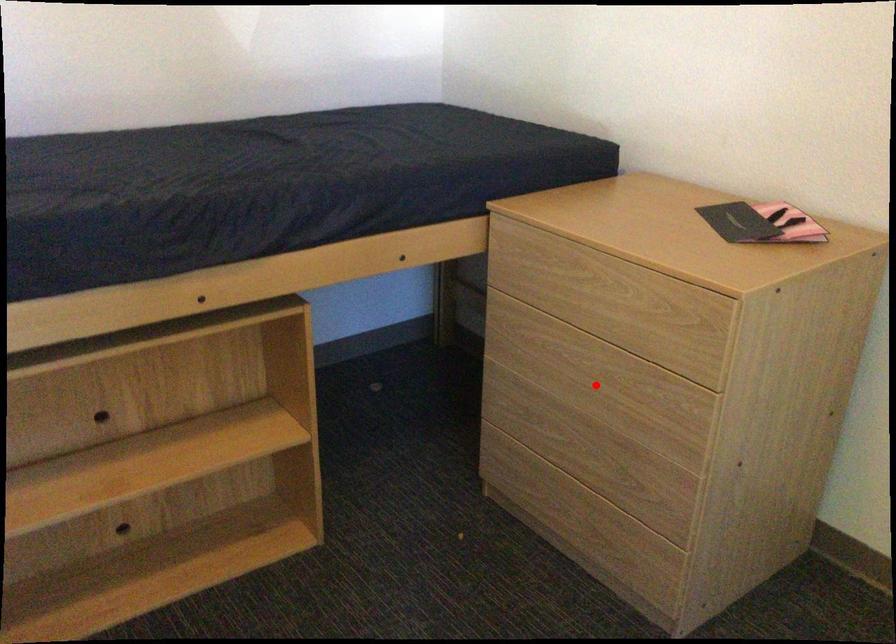
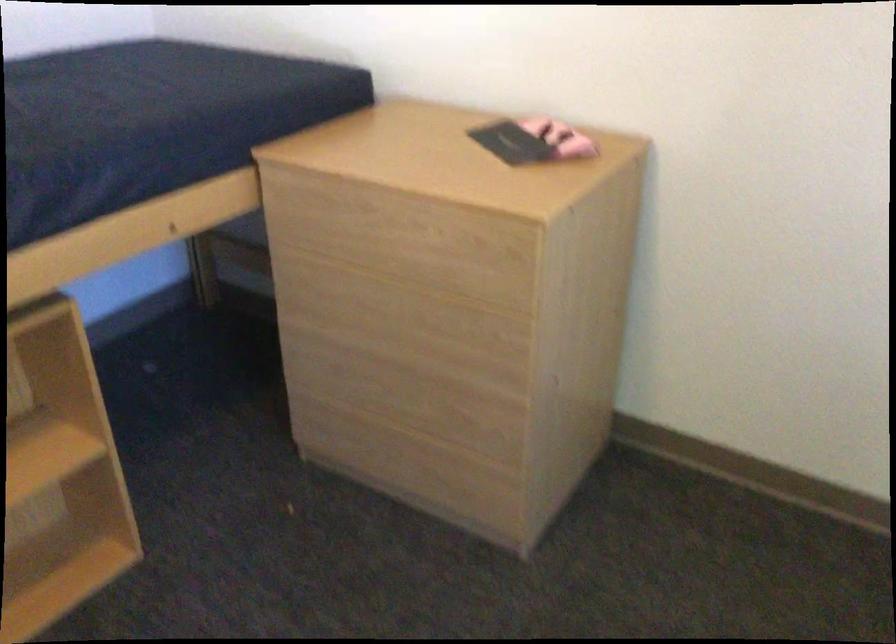
Find the pixel in the second image that matches the highlighted location in the first image.

(410, 327)